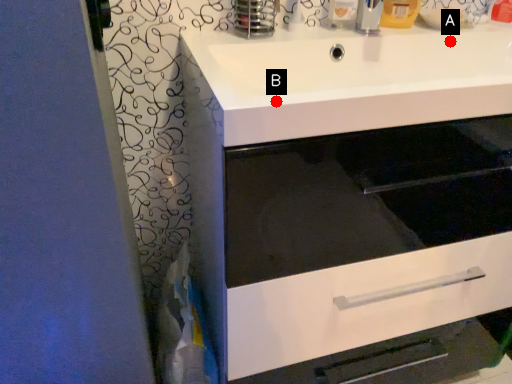
Question: Two points are circled on the image, labeled by A and B beside each circle. Which point appears farthest from the camera in this image?

Choices:
 (A) A is further
 (B) B is further

Answer: (A)